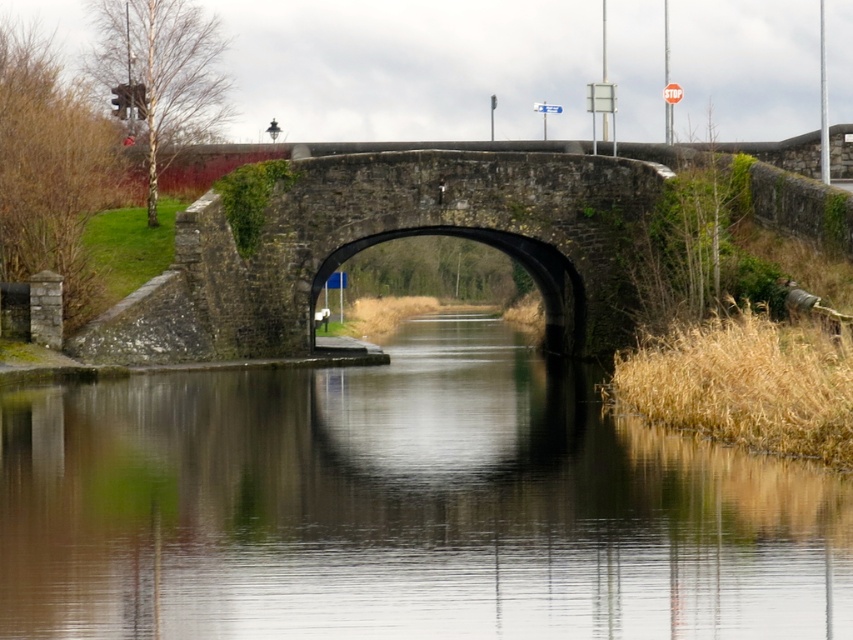
You are a boat captain navigating a narrow canal. You see the smooth brown water at center and the stone arch bridge at center ahead. Which one do you need to avoid hitting with your boat?

You need to avoid hitting the stone arch bridge at center because it is a solid structure, while the smooth brown water at center is a navigable surface.